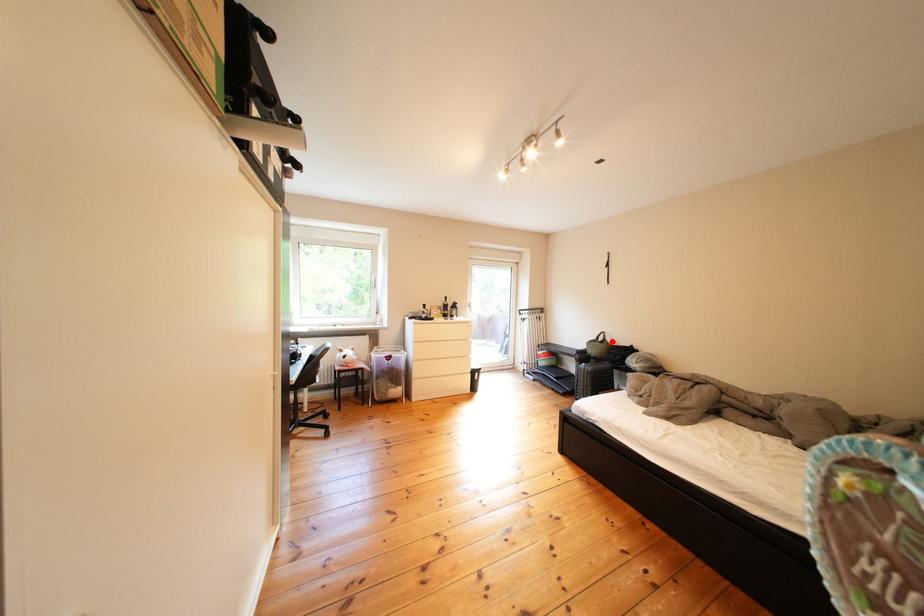
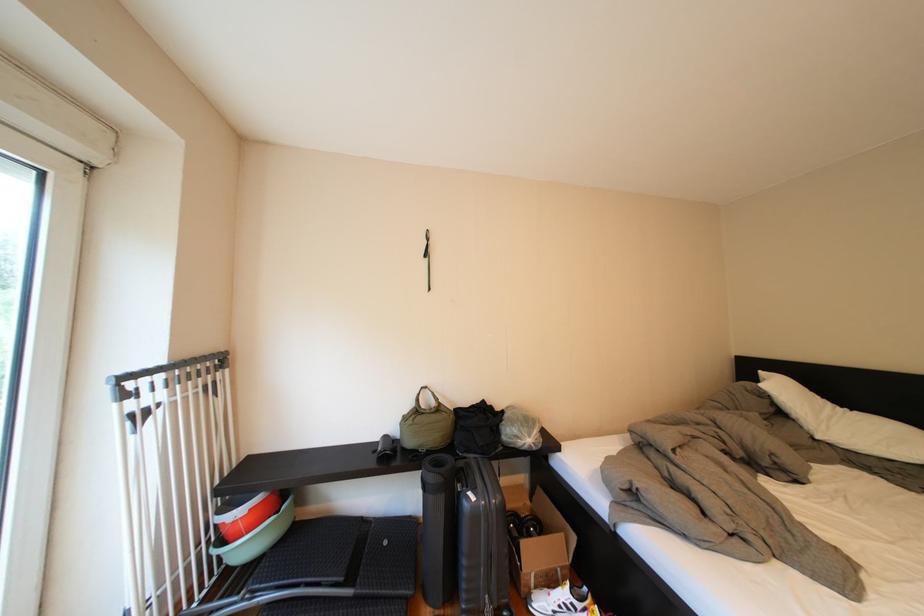
Find the pixel in the second image that matches the highlighted location in the first image.

(431, 405)